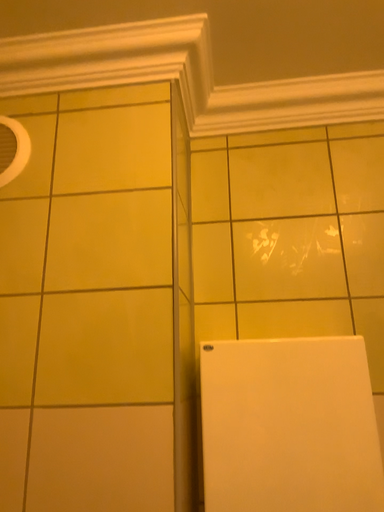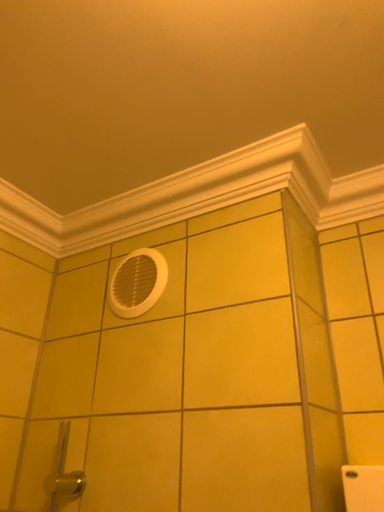
Question: How did the camera likely rotate when shooting the video?

Choices:
 (A) rotated left
 (B) rotated right

Answer: (A)